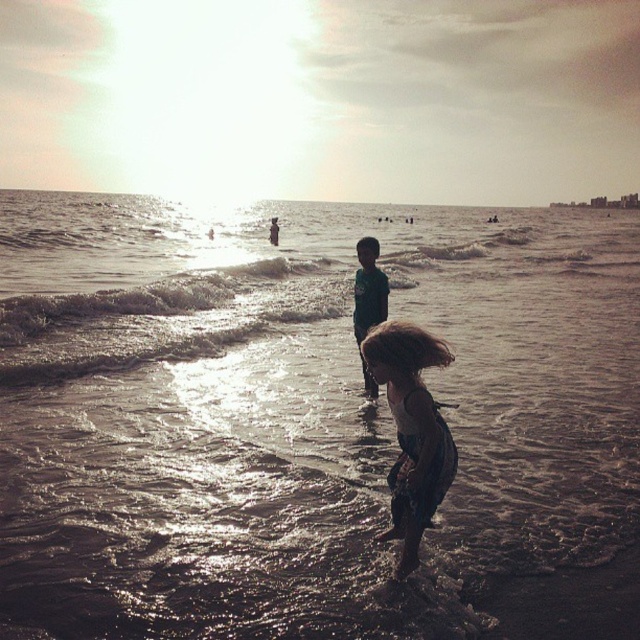
Question: Which is nearer to the green fabric shirt at center?

Choices:
 (A) shiny wet sand at center
 (B) dark hair at lower center

Answer: (B)

Question: Among these objects, which one is farthest from the camera?

Choices:
 (A) green fabric shirt at center
 (B) dark hair at lower center

Answer: (A)

Question: Among these points, which one is nearest to the camera?

Choices:
 (A) (429, 436)
 (B) (364, 408)
 (C) (372, 390)

Answer: (A)

Question: In this image, where is dark hair at lower center located relative to green fabric shirt at center?

Choices:
 (A) below
 (B) above

Answer: (A)

Question: Can you confirm if shiny wet sand at center is smaller than dark hair at lower center?

Choices:
 (A) no
 (B) yes

Answer: (A)

Question: Is shiny wet sand at center further to the viewer compared to dark hair at lower center?

Choices:
 (A) yes
 (B) no

Answer: (A)